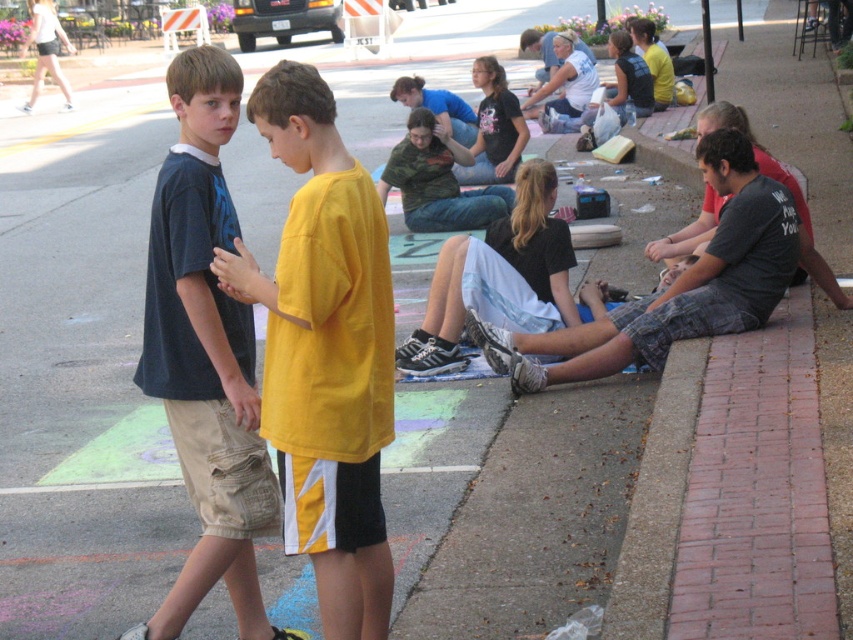
Is yellow matte shirt at center taller than camouflage shirt at center?

Yes, yellow matte shirt at center is taller than camouflage shirt at center.

Which is behind, point (305, 113) or point (422, 188)?

The point (422, 188) is behind.

Where is `yellow matte shirt at center`? The image size is (853, 640). yellow matte shirt at center is located at coordinates (325, 353).

Locate an element on the screen. yellow matte shirt at center is located at coordinates (325, 353).

Which of these two, yellow matte shirt at center or dark blue t-shirt at left, stands taller?

dark blue t-shirt at left is taller.

Between yellow matte shirt at center and dark blue t-shirt at left, which one appears on the right side from the viewer's perspective?

From the viewer's perspective, yellow matte shirt at center appears more on the right side.

Image resolution: width=853 pixels, height=640 pixels. I want to click on yellow matte shirt at center, so click(325, 353).

Who is more forward, (207, 458) or (405, 154)?

Point (207, 458) is more forward.

Between dark blue t-shirt at left and camouflage shirt at center, which one appears on the right side from the viewer's perspective?

From the viewer's perspective, camouflage shirt at center appears more on the right side.

You are a GUI agent. You are given a task and a screenshot of the screen. Output one action in this format:
    pyautogui.click(x=<x>, y=<y>)
    Task: Click on the dark blue t-shirt at left
    The image size is (853, 640).
    Given the screenshot: What is the action you would take?
    pyautogui.click(x=206, y=355)

Identify the location of dark blue t-shirt at left. This screenshot has width=853, height=640. (206, 355).